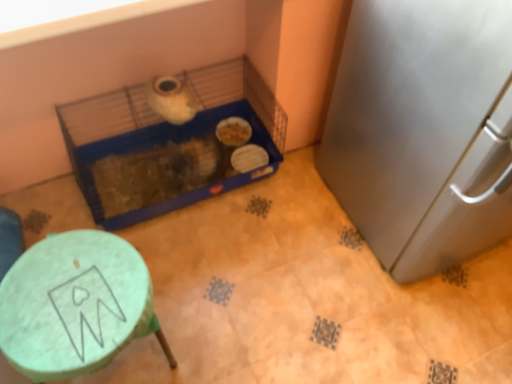
Find the location of a particular element. This screenshot has width=512, height=384. vacant space situated on the left part of satin silver refrigerator at right is located at coordinates (286, 244).